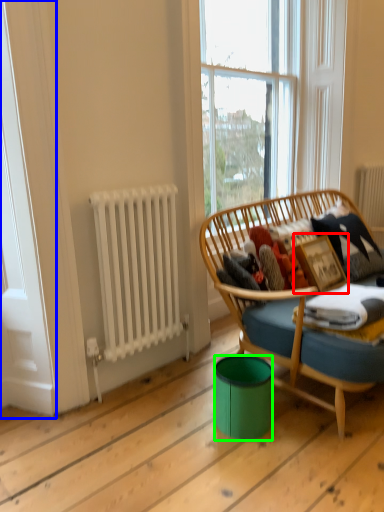
Question: Considering the real-world distances, which object is farthest from picture frame (highlighted by a red box)? screen door (highlighted by a blue box) or trash bin/can (highlighted by a green box)?

Choices:
 (A) screen door
 (B) trash bin/can

Answer: (A)